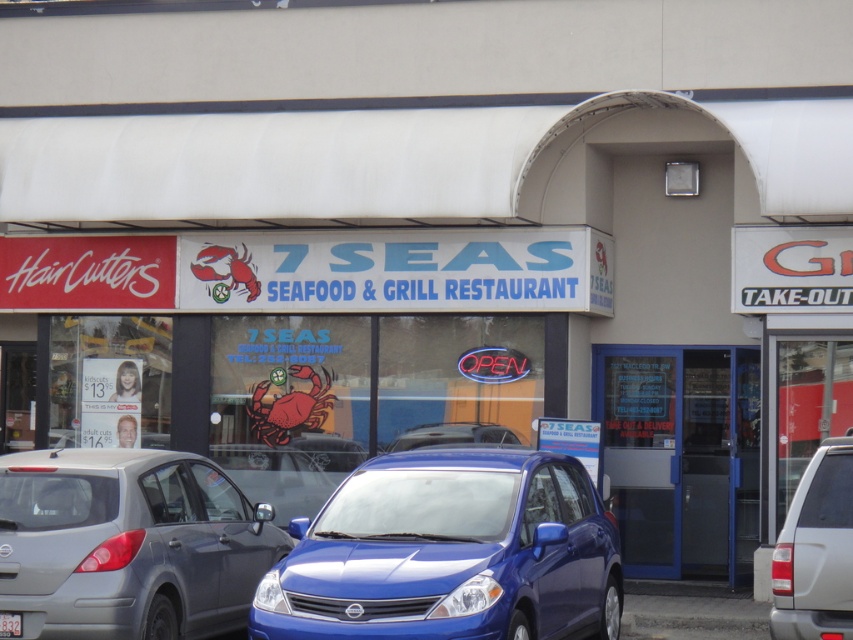
Question: Can you confirm if matte gray sedan at center is positioned above blue matte car at center?

Choices:
 (A) no
 (B) yes

Answer: (A)

Question: Which point appears closest to the camera in this image?

Choices:
 (A) (16, 612)
 (B) (498, 444)

Answer: (A)

Question: Does silver metallic suv at lower right have a larger size compared to white plastic license plate at center?

Choices:
 (A) no
 (B) yes

Answer: (B)

Question: Does matte gray sedan at center appear over silver metallic suv at lower right?

Choices:
 (A) yes
 (B) no

Answer: (B)

Question: Which object is the closest to the matte gray sedan at center?

Choices:
 (A) blue matte car at center
 (B) white plastic license plate at center
 (C) blue glossy sedan at center
 (D) silver metallic suv at lower right

Answer: (B)

Question: Which object appears farthest from the camera in this image?

Choices:
 (A) blue glossy sedan at center
 (B) blue matte car at center

Answer: (B)